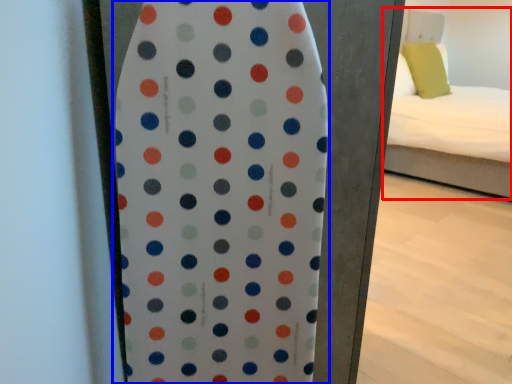
Question: Which object is closer to the camera taking this photo, bed (highlighted by a red box) or surfboard (highlighted by a blue box)?

Choices:
 (A) bed
 (B) surfboard

Answer: (B)